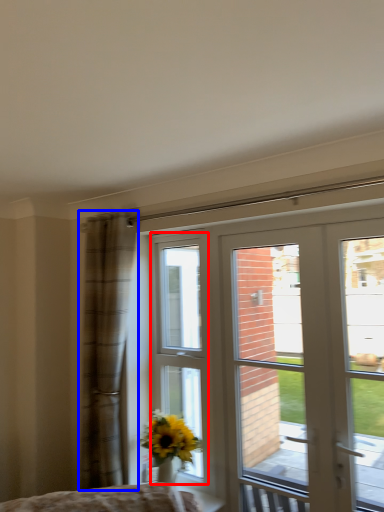
Question: Among these objects, which one is farthest to the camera, bay window (highlighted by a red box) or curtain (highlighted by a blue box)?

Choices:
 (A) bay window
 (B) curtain

Answer: (A)